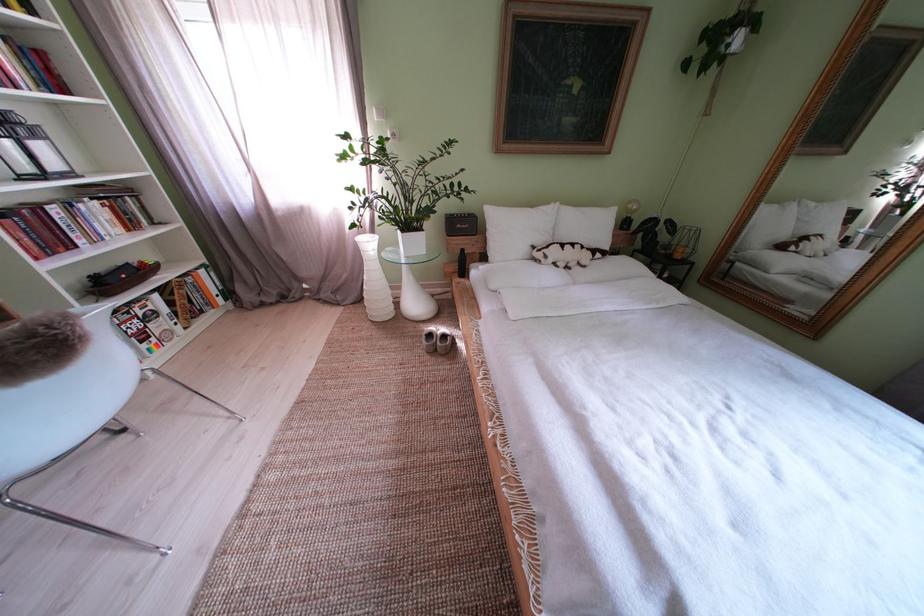
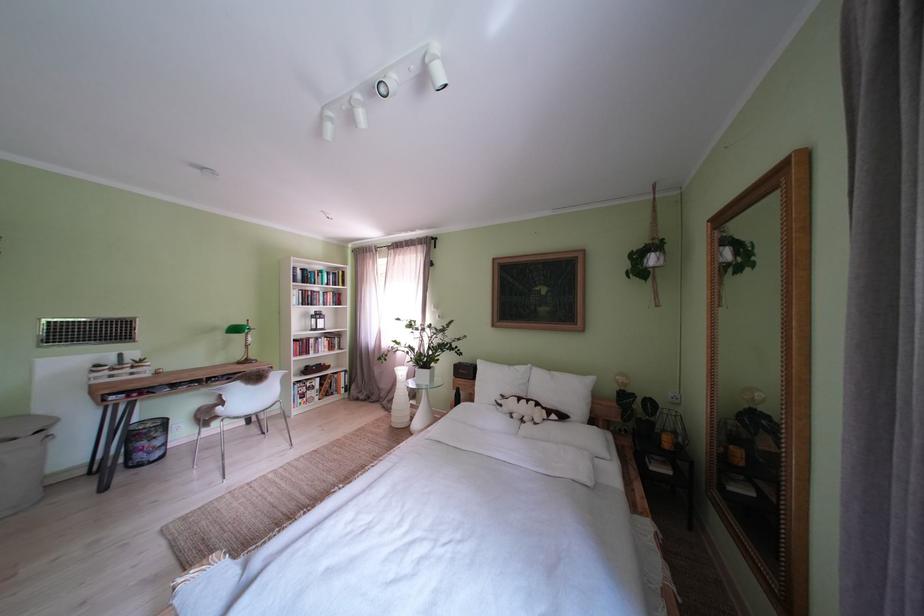
The point at (x=520, y=237) is marked in the first image. Where is the corresponding point in the second image?

(500, 386)